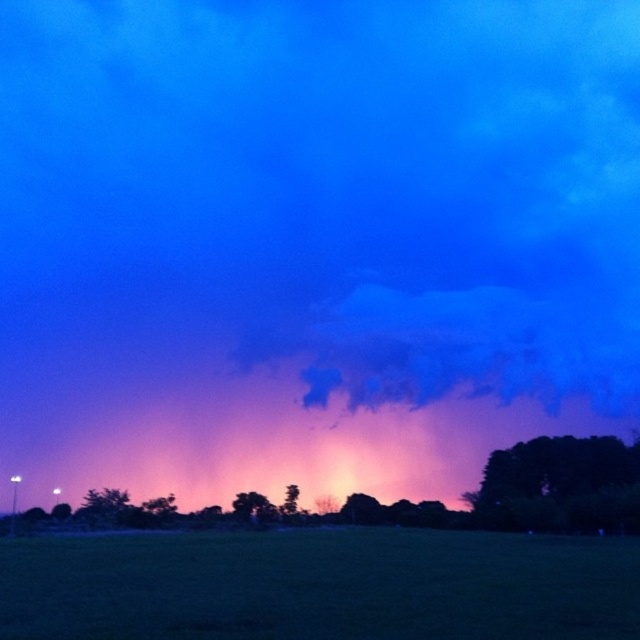
You are an astronomer observing the twilight scene. You notice two trees at the center of the image. Which tree is closer to the ground, the green matte tree at center or the green leafy tree at center?

The green matte tree at center is located below the green leafy tree at center, so it is closer to the ground.

You are standing in the twilight field and see two points of light in the distance. One is labeled as point (552, 525) and the other as point (262, 504). Which point is closer to you?

Point (552, 525) is in front of point (262, 504), so it is closer to you.

Based on the photo, you are standing in the twilight field and see two points in the distance. The first is at point (246, 504) and the second is at point (296, 493). Which point is closer to you?

Point (246, 504) is in front of point (296, 493), so it is closer to you.